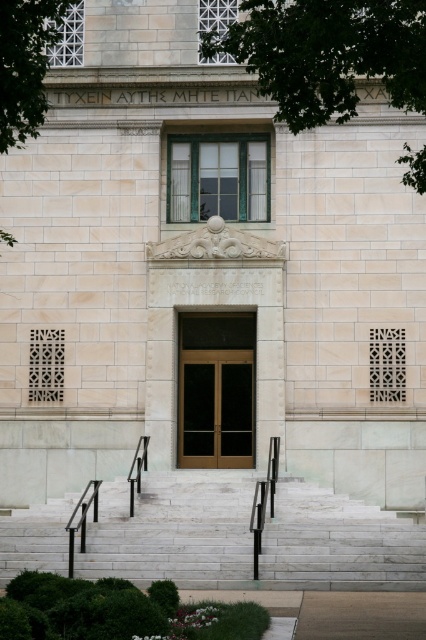
Question: Which point is farther to the camera?

Choices:
 (A) (186, 394)
 (B) (60, 3)

Answer: (A)

Question: Is the position of gold/glass door at center less distant than that of green leafy tree at upper left?

Choices:
 (A) yes
 (B) no

Answer: (B)

Question: Estimate the real-world distances between objects in this image. Which object is farther from the green leafy tree at upper left?

Choices:
 (A) white marble stairs at lower center
 (B) green leafy tree at upper center
 (C) gold/glass door at center

Answer: (C)

Question: In this image, where is green leafy tree at upper center located relative to gold/glass door at center?

Choices:
 (A) above
 (B) below

Answer: (A)

Question: Which point appears closest to the camera in this image?

Choices:
 (A) (282, 493)
 (B) (34, 51)
 (C) (189, 396)

Answer: (B)

Question: Can you confirm if white marble stairs at lower center is positioned above gold/glass door at center?

Choices:
 (A) yes
 (B) no

Answer: (B)